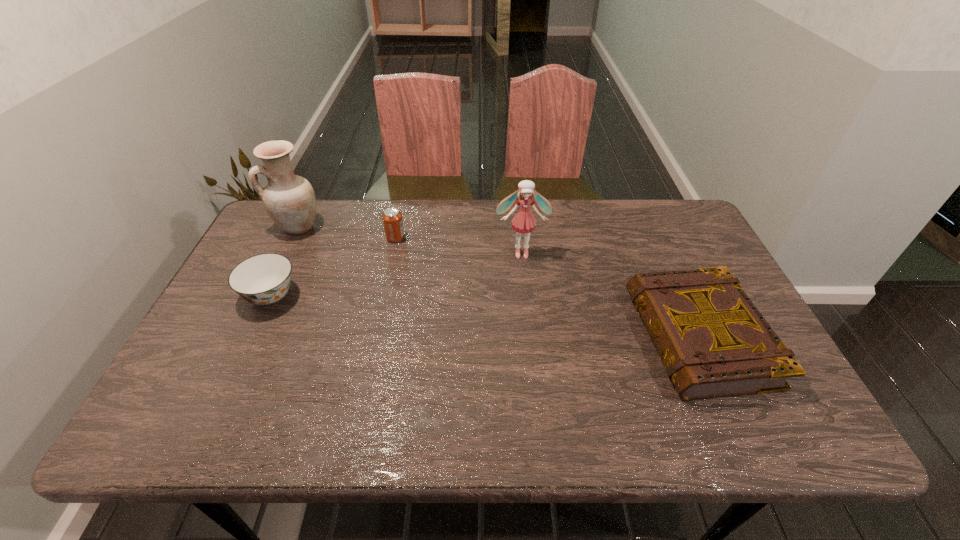
Locate an element on the screen. The width and height of the screenshot is (960, 540). free spot located on the back of the hardback book is located at coordinates (645, 219).

The height and width of the screenshot is (540, 960). Identify the location of pottery at the far edge. (289, 199).

At what (x,y) coordinates should I click in order to perform the action: click on doll located in the far edge section of the desktop. Please return your answer as a coordinate pair (x, y). The height and width of the screenshot is (540, 960). Looking at the image, I should click on (523, 221).

I want to click on can that is positioned at the far edge, so click(x=392, y=218).

The height and width of the screenshot is (540, 960). Identify the location of pottery that is at the left edge. (289, 199).

The image size is (960, 540). Identify the location of soup bowl located at the left edge. (264, 279).

Identify the location of object that is positioned at the right edge. (713, 342).

Image resolution: width=960 pixels, height=540 pixels. In order to click on object situated at the far left corner in this screenshot , I will do `click(289, 199)`.

Locate an element on the screen. Image resolution: width=960 pixels, height=540 pixels. blank space at the far edge of the desktop is located at coordinates (569, 227).

In the image, there is a desktop. At what (x,y) coordinates should I click in order to perform the action: click on vacant space at the near edge. Please return your answer as a coordinate pair (x, y). Looking at the image, I should click on (442, 424).